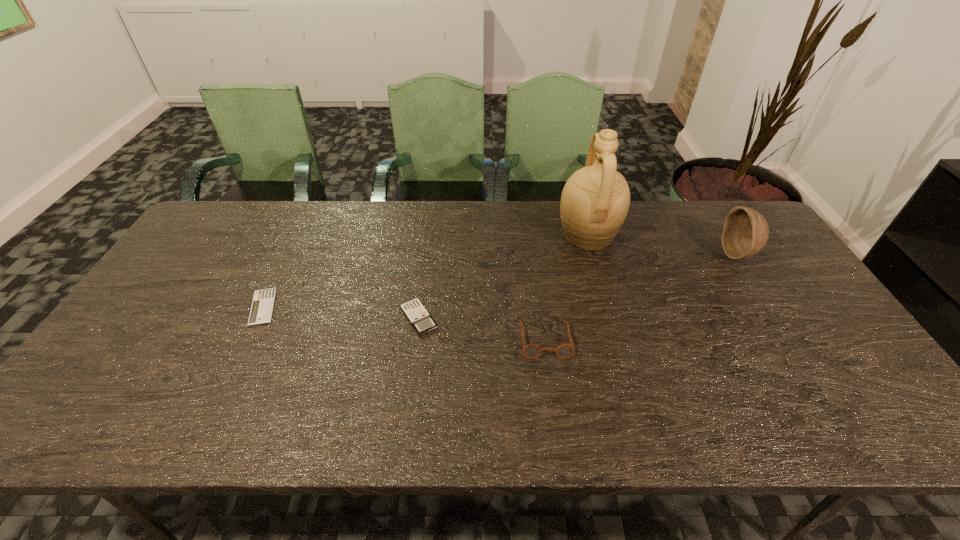
Locate an element on the screen. This screenshot has width=960, height=540. vacant space at the near edge of the desktop is located at coordinates (764, 405).

The height and width of the screenshot is (540, 960). Identify the location of free region at the left edge of the desktop. (x=142, y=340).

Identify the location of free location at the right edge. tap(846, 388).

You are a GUI agent. You are given a task and a screenshot of the screen. Output one action in this format:
    pyautogui.click(x=<x>, y=<y>)
    Task: Click on the vacant area that lies between the second object from right to left and the third object from left to right
    This screenshot has height=540, width=960.
    Given the screenshot: What is the action you would take?
    pyautogui.click(x=566, y=288)

Identify the location of vacant area between the rightmost object and the tallest object. (662, 245).

I want to click on free area in between the taller calculator and the second tallest object, so click(578, 286).

In order to click on vacant area between the shorter calculator and the second tallest object in this screenshot , I will do `click(500, 280)`.

The height and width of the screenshot is (540, 960). What are the coordinates of `free space between the spectacles and the right calculator` in the screenshot? It's located at (482, 329).

I want to click on vacant space in between the right calculator and the pitcher, so click(x=503, y=276).

Find the location of a particular element. free space that is in between the rightmost object and the third shortest object is located at coordinates (641, 297).